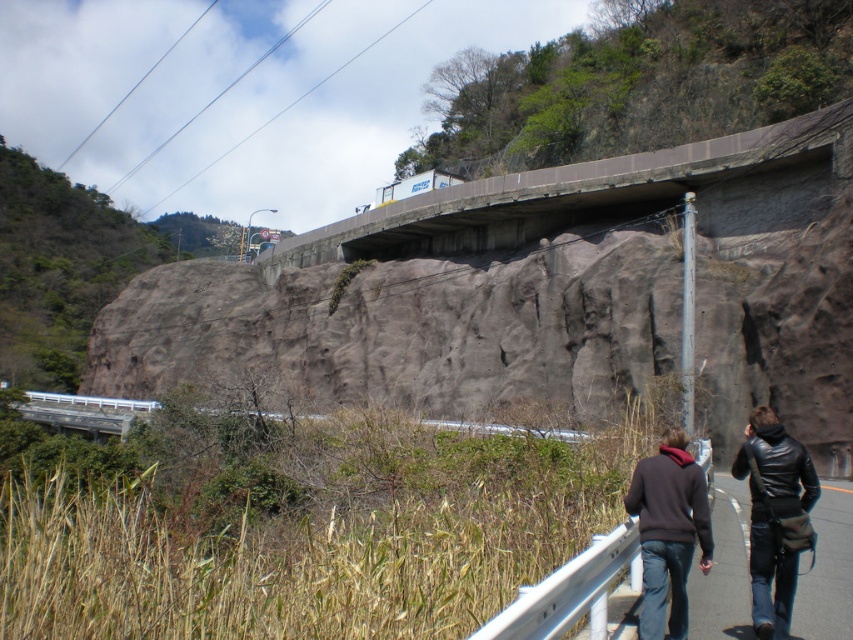
Consider the image. Is dark brown leather jacket at lower right taller than black leather jacket at lower right?

Indeed, dark brown leather jacket at lower right has a greater height compared to black leather jacket at lower right.

Is point (801, 458) closer to camera compared to point (757, 598)?

No, (801, 458) is behind (757, 598).

Which is in front, point (779, 636) or point (785, 438)?

Point (779, 636) is more forward.

Identify the location of dark brown leather jacket at lower right. The height and width of the screenshot is (640, 853). (775, 516).

Does point (492, 186) come behind point (761, 426)?

Yes.

This screenshot has width=853, height=640. What do you see at coordinates (602, 196) in the screenshot?
I see `concrete bridge at upper center` at bounding box center [602, 196].

Locate an element on the screen. This screenshot has height=640, width=853. concrete bridge at upper center is located at coordinates (602, 196).

Is concrete bridge at upper center positioned in front of black leather jacket at lower right?

No, concrete bridge at upper center is behind black leather jacket at lower right.

In order to click on concrete bridge at upper center in this screenshot , I will do `click(602, 196)`.

What do you see at coordinates (602, 196) in the screenshot?
I see `concrete bridge at upper center` at bounding box center [602, 196].

Where is `concrete bridge at upper center`? concrete bridge at upper center is located at coordinates (602, 196).